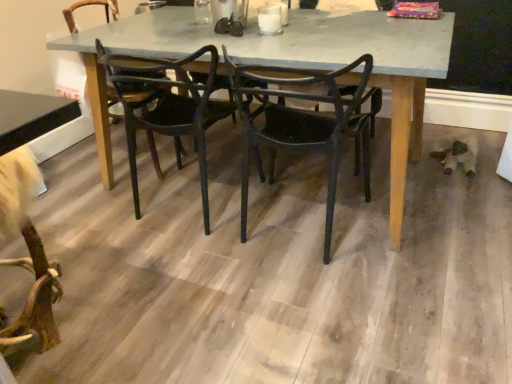
In order to click on free location in front of black matte chair at center, the first chair from the right in this screenshot , I will do `click(318, 312)`.